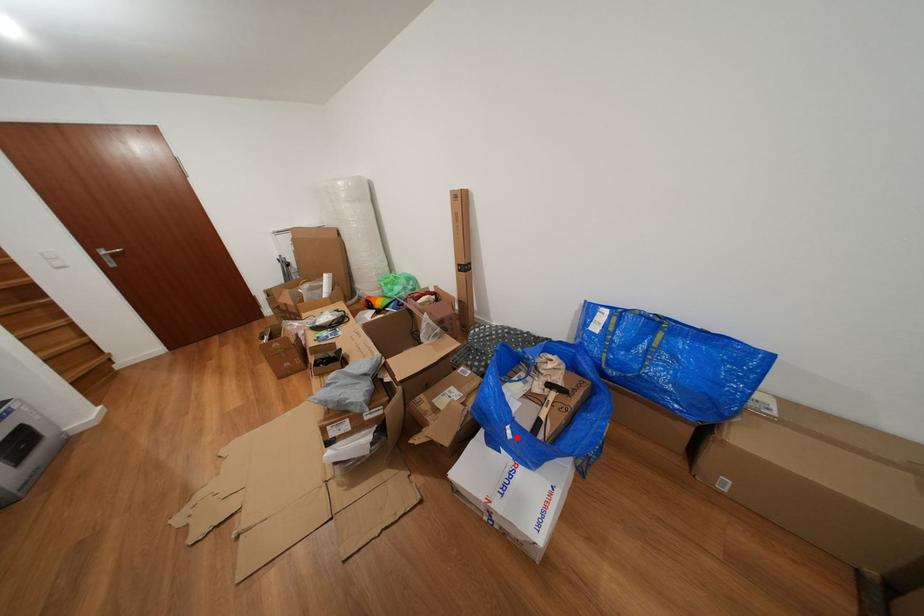
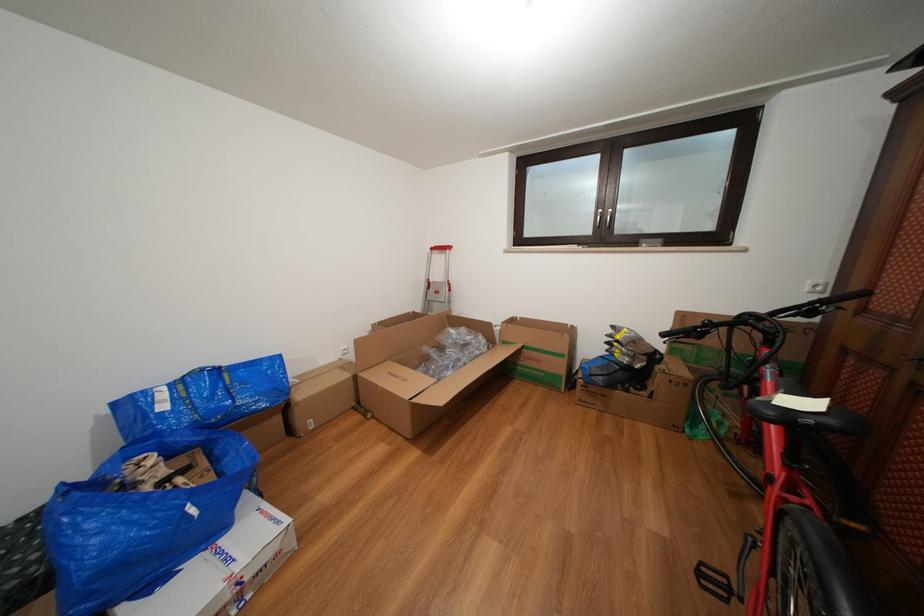
Locate, in the second image, the point that corresponds to the highlighted location in the first image.

(201, 516)